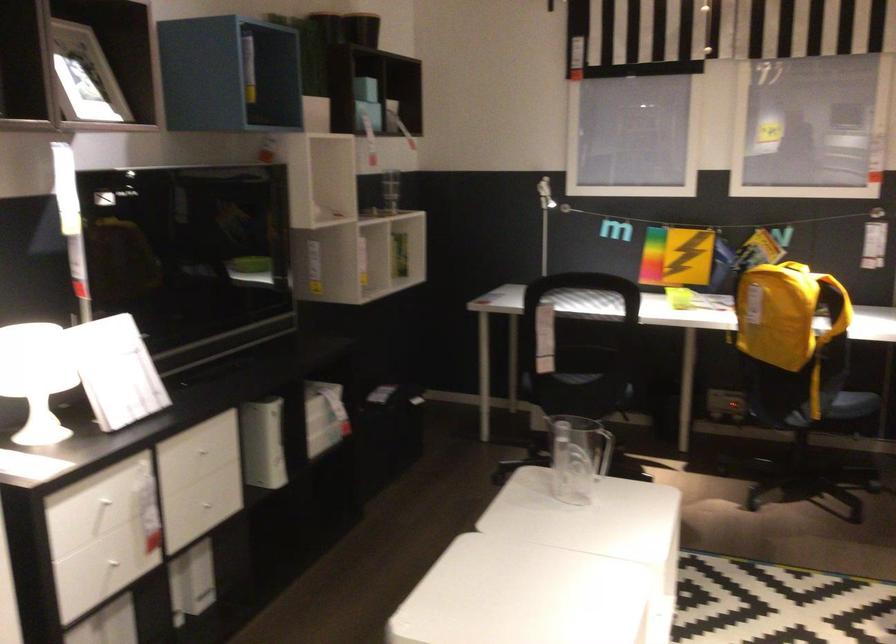
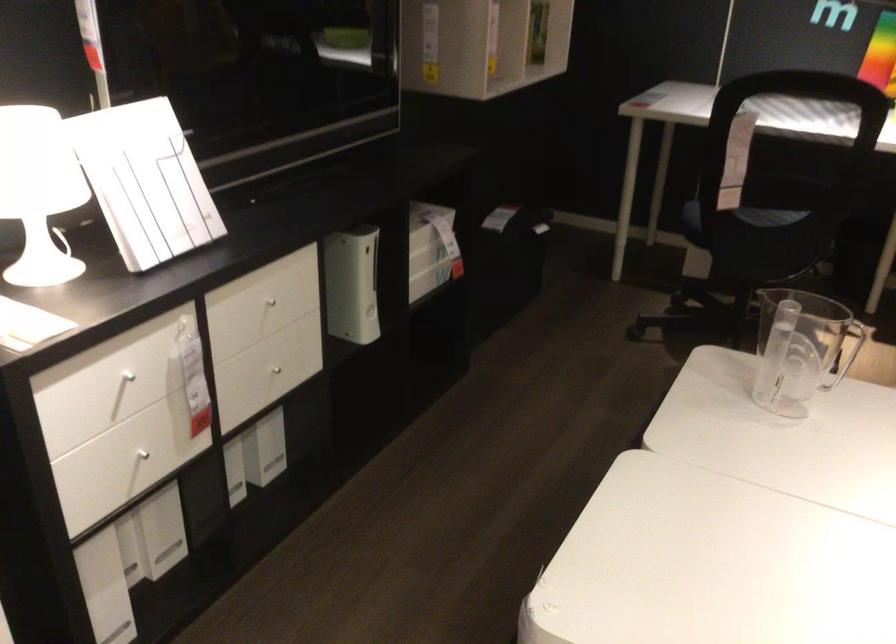
Question: Based on the continuous images, in which direction is the camera rotating? Reply with the corresponding letter.

Choices:
 (A) Left
 (B) Right
 (C) Up
 (D) Down

Answer: (D)